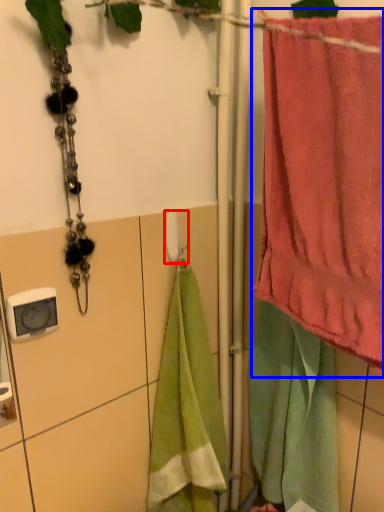
Question: Which of the following is the farthest to the observer, towel bar (highlighted by a red box) or towel (highlighted by a blue box)?

Choices:
 (A) towel bar
 (B) towel

Answer: (A)